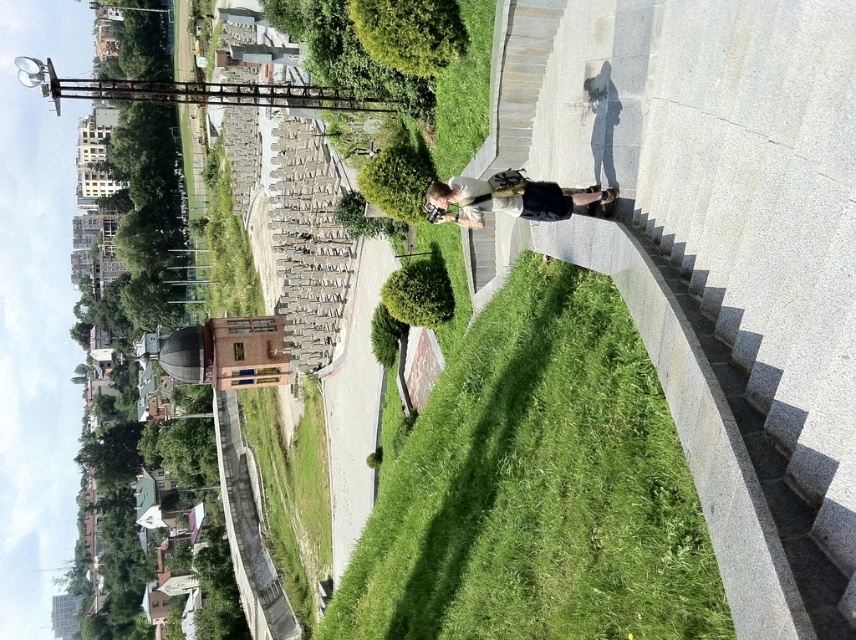
Question: Is green grassy at center thinner than light beige fabric jacket at center?

Choices:
 (A) no
 (B) yes

Answer: (A)

Question: Does green grassy at center have a larger size compared to light beige fabric jacket at center?

Choices:
 (A) no
 (B) yes

Answer: (B)

Question: Can you confirm if green grassy at center is thinner than light beige fabric jacket at center?

Choices:
 (A) no
 (B) yes

Answer: (A)

Question: Which point is closer to the camera?

Choices:
 (A) green grassy at center
 (B) light beige fabric jacket at center

Answer: (A)

Question: Which point appears closest to the camera in this image?

Choices:
 (A) (431, 202)
 (B) (605, 509)

Answer: (B)

Question: Among these points, which one is nearest to the camera?

Choices:
 (A) tap(492, 205)
 (B) tap(575, 522)

Answer: (B)